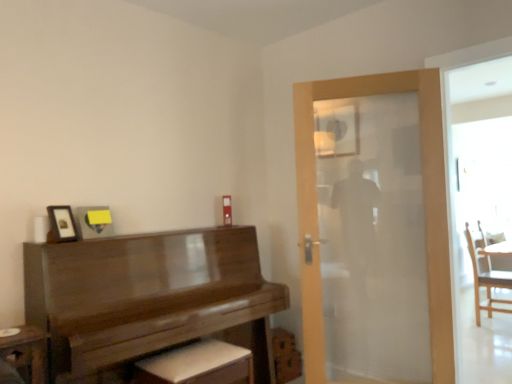
Measure the distance between wooden chair at right and camera.

3.99 meters.

You are a GUI agent. You are given a task and a screenshot of the screen. Output one action in this format:
    pyautogui.click(x=<x>, y=<y>)
    Task: Click on the matte glass mirror at upper center
    
    Given the screenshot: What is the action you would take?
    pyautogui.click(x=337, y=131)

What is the approximate width of translucent glass door at center?

The width of translucent glass door at center is 4.83 inches.

This screenshot has width=512, height=384. What do you see at coordinates (149, 297) in the screenshot? I see `wooden piano at left` at bounding box center [149, 297].

This screenshot has width=512, height=384. What do you see at coordinates (61, 224) in the screenshot?
I see `matte black picture frame at upper left` at bounding box center [61, 224].

The width and height of the screenshot is (512, 384). What do you see at coordinates (197, 365) in the screenshot?
I see `white leather footrest at lower center` at bounding box center [197, 365].

At what (x,y) coordinates should I click in order to perform the action: click on wooden chair at right. Please return your answer as a coordinate pair (x, y). Looking at the image, I should click on (486, 277).

The image size is (512, 384). In order to click on chair directly beneath the wooden piano at left (from a real-world perspective) in this screenshot , I will do click(486, 277).

Is wooden piano at left positioned in front of wooden chair at right?

Yes.

Who is smaller, wooden piano at left or wooden chair at right?

With smaller size is wooden chair at right.

Which is more to the left, wooden piano at left or wooden chair at right?

wooden piano at left is more to the left.

Which is more to the left, matte black picture frame at upper left or matte glass mirror at upper center?

From the viewer's perspective, matte black picture frame at upper left appears more on the left side.

Is matte black picture frame at upper left not inside matte glass mirror at upper center?

Absolutely, matte black picture frame at upper left is external to matte glass mirror at upper center.

Consider the image. Who is taller, matte black picture frame at upper left or matte glass mirror at upper center?

Standing taller between the two is matte glass mirror at upper center.

Considering the points (62, 241) and (355, 145), which point is in front, point (62, 241) or point (355, 145)?

The point (62, 241) is more forward.

From their relative heights in the image, would you say translucent glass door at center is taller or shorter than matte black picture frame at upper left?

Considering their sizes, translucent glass door at center has more height than matte black picture frame at upper left.

Who is bigger, translucent glass door at center or matte black picture frame at upper left?

With larger size is translucent glass door at center.

Which of these two, translucent glass door at center or matte black picture frame at upper left, is wider?

translucent glass door at center is wider.

Considering the positions of objects translucent glass door at center and matte black picture frame at upper left in the image provided, who is more to the right, translucent glass door at center or matte black picture frame at upper left?

From the viewer's perspective, translucent glass door at center appears more on the right side.

Is matte glass mirror at upper center further to the viewer compared to wooden piano at left?

That is True.

Based on their sizes in the image, would you say matte glass mirror at upper center is bigger or smaller than wooden piano at left?

Considering their sizes, matte glass mirror at upper center takes up less space than wooden piano at left.

Can you confirm if matte glass mirror at upper center is positioned to the left of wooden piano at left?

No.

Is wooden piano at left at the back of matte glass mirror at upper center?

No, matte glass mirror at upper center is not facing the opposite direction of wooden piano at left.

Considering the sizes of objects matte black picture frame at upper left and white leather footrest at lower center in the image provided, who is bigger, matte black picture frame at upper left or white leather footrest at lower center?

white leather footrest at lower center is bigger.

Is matte black picture frame at upper left located outside white leather footrest at lower center?

matte black picture frame at upper left lies outside white leather footrest at lower center's area.

Is matte black picture frame at upper left next to white leather footrest at lower center?

matte black picture frame at upper left and white leather footrest at lower center are clearly separated.

I want to click on mirror on the left of the wooden chair at right, so click(337, 131).

Is wooden chair at right turned away from matte glass mirror at upper center?

No, wooden chair at right is not facing the opposite direction of matte glass mirror at upper center.

Is matte glass mirror at upper center surrounded by wooden chair at right?

No, matte glass mirror at upper center is not surrounded by wooden chair at right.

Are wooden chair at right and matte glass mirror at upper center located far from each other?

Yes, wooden chair at right and matte glass mirror at upper center are located far from each other.

Is wooden piano at left turned away from white leather footrest at lower center?

Yes, white leather footrest at lower center is at the back of wooden piano at left.

Does wooden piano at left have a larger size compared to white leather footrest at lower center?

Indeed, wooden piano at left has a larger size compared to white leather footrest at lower center.

Is wooden piano at left touching white leather footrest at lower center?

No, wooden piano at left is not in contact with white leather footrest at lower center.

Is point (121, 265) behind point (223, 375)?

That is True.

Identify the location of chair that is below the wooden piano at left (from the image's perspective). (x=486, y=277).

At what (x,y) coordinates should I click in order to perform the action: click on mirror to the right of matte black picture frame at upper left. Please return your answer as a coordinate pair (x, y). Looking at the image, I should click on (337, 131).

Which object lies further to the anchor point white leather footrest at lower center, matte black picture frame at upper left or translucent glass door at center?

Based on the image, translucent glass door at center appears to be further to white leather footrest at lower center.

Estimate the real-world distances between objects in this image. Which object is closer to wooden chair at right, matte black picture frame at upper left or translucent glass door at center?

Based on the image, translucent glass door at center appears to be nearer to wooden chair at right.

Which object lies further to the anchor point matte glass mirror at upper center, wooden piano at left or white leather footrest at lower center?

Among the two, white leather footrest at lower center is located further to matte glass mirror at upper center.

Estimate the real-world distances between objects in this image. Which object is closer to wooden piano at left, wooden chair at right or matte black picture frame at upper left?

The object closer to wooden piano at left is matte black picture frame at upper left.

Based on their spatial positions, is wooden chair at right or translucent glass door at center closer to white leather footrest at lower center?

The object closer to white leather footrest at lower center is translucent glass door at center.

From the image, which object appears to be nearer to matte glass mirror at upper center, wooden chair at right or matte black picture frame at upper left?

matte black picture frame at upper left lies closer to matte glass mirror at upper center than the other object.

Which object lies further to the anchor point translucent glass door at center, white leather footrest at lower center or wooden chair at right?

wooden chair at right lies further to translucent glass door at center than the other object.

Estimate the real-world distances between objects in this image. Which object is closer to white leather footrest at lower center, wooden piano at left or matte glass mirror at upper center?

The object closer to white leather footrest at lower center is wooden piano at left.

Where is `door between matte black picture frame at upper left and wooden chair at right in the horizontal direction`? The image size is (512, 384). door between matte black picture frame at upper left and wooden chair at right in the horizontal direction is located at coordinates (424, 205).

Identify the location of mirror situated between matte black picture frame at upper left and translucent glass door at center from left to right. The width and height of the screenshot is (512, 384). (337, 131).

Find the location of a particular element. The height and width of the screenshot is (384, 512). door between wooden piano at left and wooden chair at right from left to right is located at coordinates (424, 205).

Locate an element on the screen. The height and width of the screenshot is (384, 512). mirror situated between wooden piano at left and wooden chair at right from left to right is located at coordinates (337, 131).